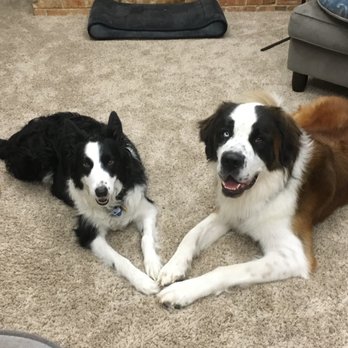
I want to click on carpet, so click(317, 304).